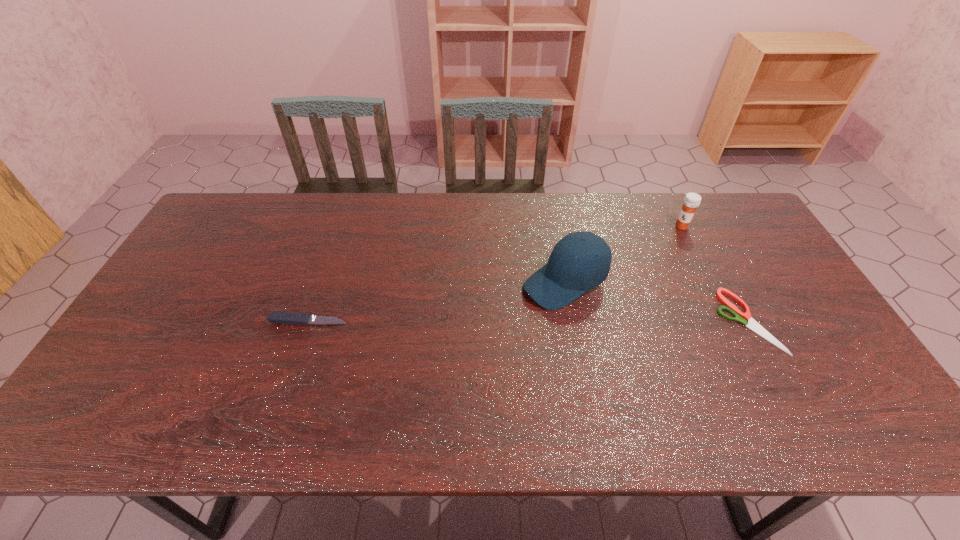
Image resolution: width=960 pixels, height=540 pixels. Identify the location of vacant area located 0.330m on the front-facing side of the tallest object. (426, 348).

The image size is (960, 540). I want to click on free location located on the front-facing side of the tallest object, so click(486, 319).

The width and height of the screenshot is (960, 540). What are the coordinates of `vacant position located 0.160m on the label side of the medicine` in the screenshot? It's located at 652,252.

At what (x,y) coordinates should I click in order to perform the action: click on free space located 0.280m on the label side of the medicine. Please return your answer as a coordinate pair (x, y). Looking at the image, I should click on (630, 271).

This screenshot has height=540, width=960. Identify the location of free region located on the label side of the medicine. (628, 273).

Locate an element on the screen. The image size is (960, 540). object present at the far edge is located at coordinates (692, 200).

I want to click on object at the right edge, so coord(742,318).

In the image, there is a desktop. At what (x,y) coordinates should I click in order to perform the action: click on free region at the far edge. Please return your answer as a coordinate pair (x, y). The image size is (960, 540). Looking at the image, I should click on (616, 220).

Image resolution: width=960 pixels, height=540 pixels. In the image, there is a desktop. In order to click on blank space at the near edge in this screenshot , I will do `click(690, 366)`.

Identify the location of vacant space at the left edge of the desktop. Image resolution: width=960 pixels, height=540 pixels. (190, 272).